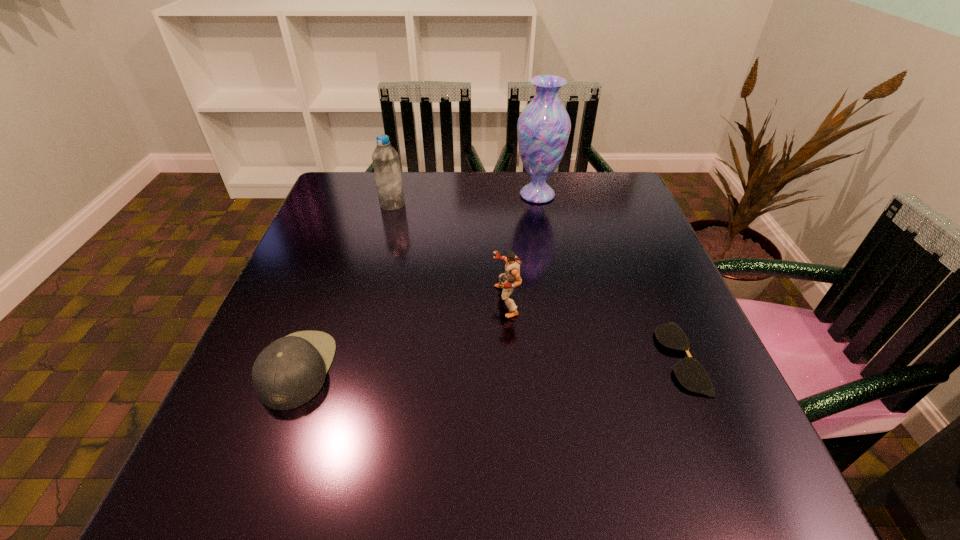
Find the location of `free spot located 0.100m on the front-facing side of the third nearest object`. free spot located 0.100m on the front-facing side of the third nearest object is located at coordinates (444, 301).

Find the location of a particular element. Image resolution: width=960 pixels, height=540 pixels. vacant space situated on the front-facing side of the third nearest object is located at coordinates (425, 301).

Where is `free space located 0.340m on the front-facing side of the third nearest object`? The image size is (960, 540). free space located 0.340m on the front-facing side of the third nearest object is located at coordinates (329, 301).

Where is `vacant space situated on the brim of the fourth tallest object`? vacant space situated on the brim of the fourth tallest object is located at coordinates (465, 369).

You are a GUI agent. You are given a task and a screenshot of the screen. Output one action in this format:
    pyautogui.click(x=<x>, y=<y>)
    Task: Click on the free region located 0.110m on the front of the spectacles
    The image size is (960, 540).
    Given the screenshot: What is the action you would take?
    pyautogui.click(x=723, y=461)

Find the location of a particular element. Image resolution: width=960 pixels, height=540 pixels. vase located in the far edge section of the desktop is located at coordinates (543, 128).

This screenshot has width=960, height=540. I want to click on water bottle that is at the far edge, so click(385, 158).

This screenshot has height=540, width=960. What are the coordinates of `water bottle present at the left edge` in the screenshot? It's located at (385, 158).

At what (x,y) coordinates should I click in order to perform the action: click on cap located at the left edge. Please return your answer as a coordinate pair (x, y). Image resolution: width=960 pixels, height=540 pixels. Looking at the image, I should click on (289, 372).

Where is `object that is at the right edge`? The image size is (960, 540). object that is at the right edge is located at coordinates (690, 373).